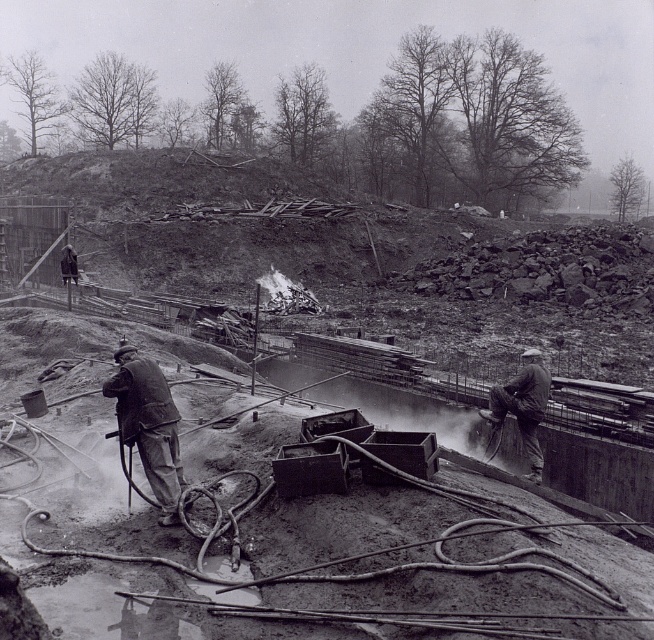
Does point (162, 376) come behind point (538, 404)?

No, (162, 376) is in front of (538, 404).

Which is behind, point (135, 413) or point (489, 410)?

Positioned behind is point (489, 410).

The height and width of the screenshot is (640, 654). Find the location of `matte gray jacket at center`. matte gray jacket at center is located at coordinates (148, 424).